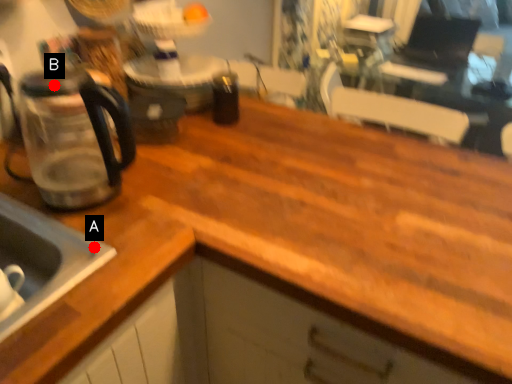
Question: Two points are circled on the image, labeled by A and B beside each circle. Which point is farther to the camera?

Choices:
 (A) A is further
 (B) B is further

Answer: (A)